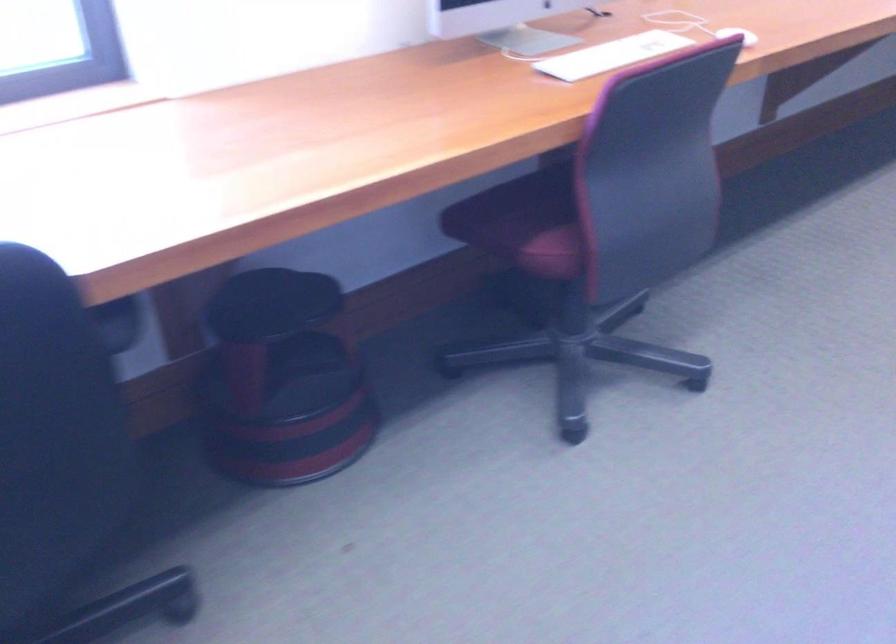
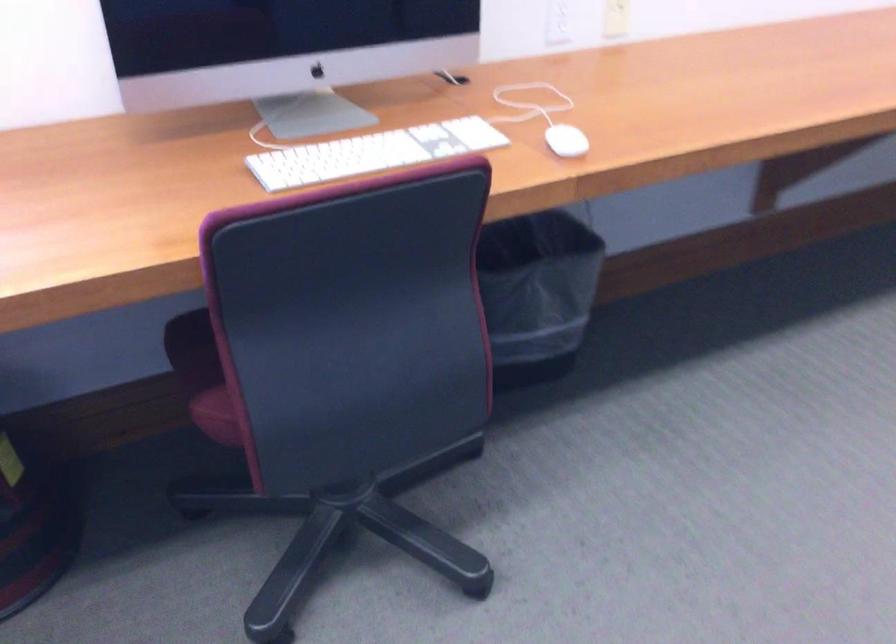
Question: The camera is either moving clockwise (left) or counter-clockwise (right) around the object. The first image is from the beginning of the video and the second image is from the end. Is the camera moving left or right when shooting the video?

Choices:
 (A) Left
 (B) Right

Answer: (B)